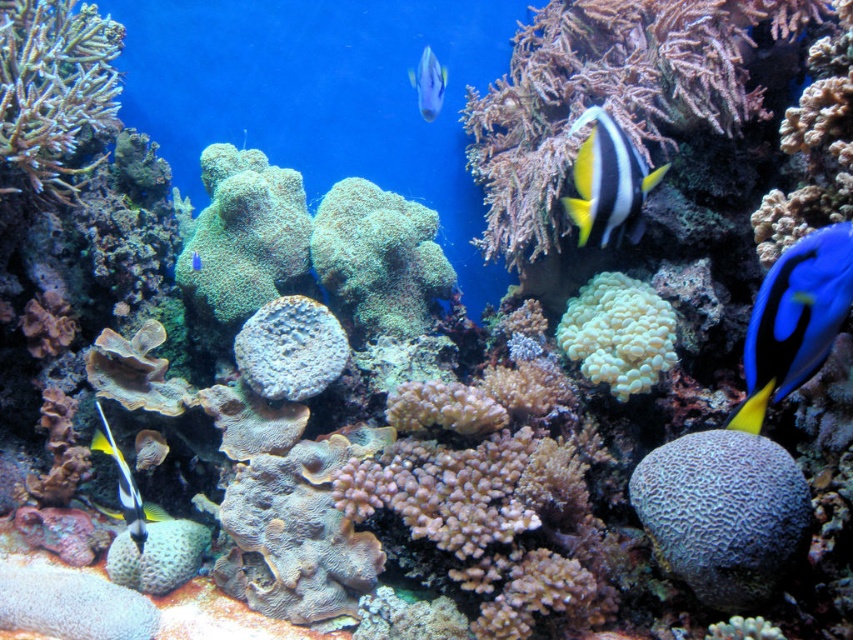
You are a marine biologist observing this underwater scene. You notice two fish species here. The shiny silver fish at upper center and the blue glossy fish at center. Which fish is located to the right of the other?

The shiny silver fish at upper center is positioned on the right side of the blue glossy fish at center.